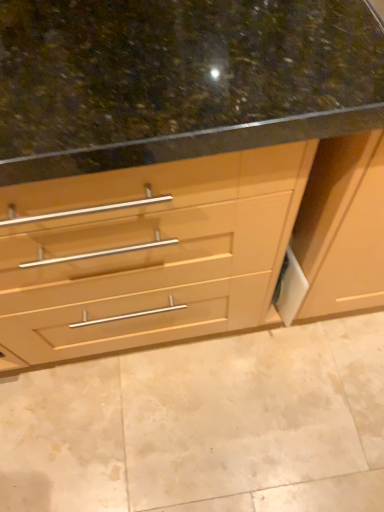
Question: From a real-world perspective, relative to matte wood cabinet at center, is brown polished granite at center vertically above or below?

Choices:
 (A) above
 (B) below

Answer: (B)

Question: Considering the positions of brown polished granite at center and matte wood cabinet at center in the image, is brown polished granite at center wider or thinner than matte wood cabinet at center?

Choices:
 (A) thin
 (B) wide

Answer: (B)

Question: In terms of size, does brown polished granite at center appear bigger or smaller than matte wood cabinet at center?

Choices:
 (A) big
 (B) small

Answer: (B)

Question: Based on their positions, is matte wood cabinet at center located to the left or right of brown polished granite at center?

Choices:
 (A) right
 (B) left

Answer: (A)

Question: Considering their positions, is matte wood cabinet at center located in front of or behind brown polished granite at center?

Choices:
 (A) behind
 (B) front

Answer: (B)

Question: In terms of size, does matte wood cabinet at center appear bigger or smaller than brown polished granite at center?

Choices:
 (A) big
 (B) small

Answer: (A)

Question: Choose the correct answer: Is matte wood cabinet at center inside brown polished granite at center or outside it?

Choices:
 (A) inside
 (B) outside

Answer: (B)